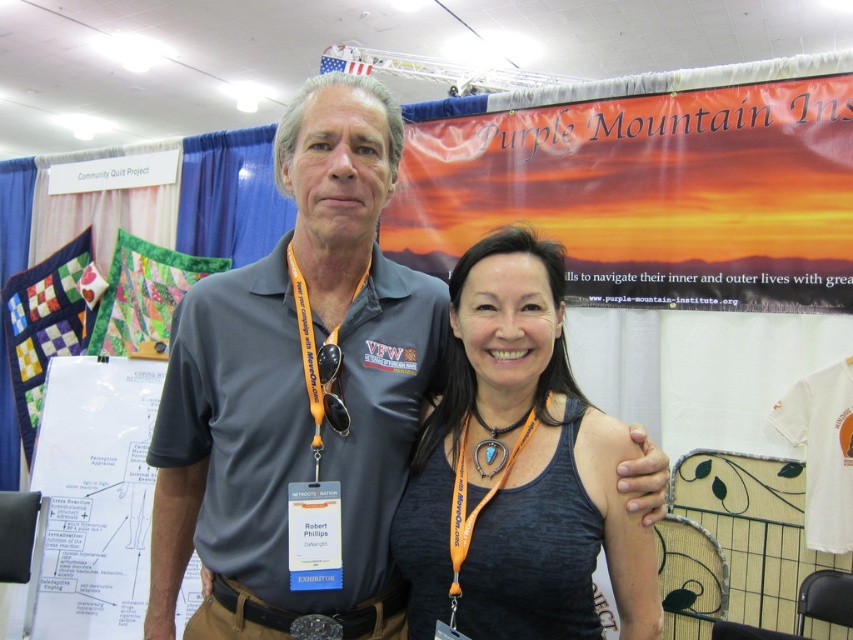
Does orange fabric lanyard at center have a greater width compared to turquoise stone pendant at center?

Yes.

Does orange fabric lanyard at center have a smaller size compared to turquoise stone pendant at center?

Actually, orange fabric lanyard at center might be larger than turquoise stone pendant at center.

Who is more forward, [317,472] or [490,468]?

Positioned in front is point [317,472].

Identify the location of orange fabric lanyard at center. [317, 369].

The width and height of the screenshot is (853, 640). What do you see at coordinates (297, 394) in the screenshot?
I see `gray fabric shirt at center` at bounding box center [297, 394].

Is point (320, 339) more distant than point (546, 380)?

No, (320, 339) is closer to viewer.

This screenshot has height=640, width=853. In order to click on gray fabric shirt at center in this screenshot , I will do `click(297, 394)`.

Between dark gray tank top at center and turquoise stone pendant at center, which one has more height?

dark gray tank top at center is taller.

Which is more to the right, dark gray tank top at center or turquoise stone pendant at center?

dark gray tank top at center is more to the right.

Who is more distant from viewer, (498, 538) or (474, 460)?

Positioned behind is point (474, 460).

Image resolution: width=853 pixels, height=640 pixels. In order to click on dark gray tank top at center in this screenshot , I will do `click(508, 458)`.